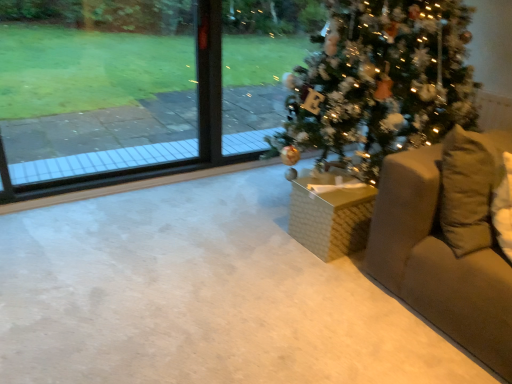
Question: From a real-world perspective, is beige fabric couch at right, the 2th furniture positioned from the left, beneath transparent glass window at upper left?

Choices:
 (A) no
 (B) yes

Answer: (B)

Question: Is transparent glass window at upper left at the back of beige fabric couch at right, the first furniture viewed from the right?

Choices:
 (A) yes
 (B) no

Answer: (B)

Question: Is beige fabric couch at right, the 2th furniture positioned from the left, positioned far away from transparent glass window at upper left?

Choices:
 (A) no
 (B) yes

Answer: (B)

Question: From a real-world perspective, is beige fabric couch at right, the 2th furniture positioned from the left, positioned over transparent glass window at upper left based on gravity?

Choices:
 (A) no
 (B) yes

Answer: (A)

Question: Is beige fabric couch at right, the 2th furniture positioned from the left, positioned behind transparent glass window at upper left?

Choices:
 (A) yes
 (B) no

Answer: (B)

Question: From the image's perspective, is transparent glass window at upper left positioned above or below shiny green christmas tree at center?

Choices:
 (A) above
 (B) below

Answer: (A)

Question: Is transparent glass window at upper left inside or outside of shiny green christmas tree at center?

Choices:
 (A) inside
 (B) outside

Answer: (B)

Question: Is transparent glass window at upper left wider or thinner than shiny green christmas tree at center?

Choices:
 (A) thin
 (B) wide

Answer: (A)

Question: Considering the relative positions of transparent glass window at upper left and shiny green christmas tree at center in the image provided, is transparent glass window at upper left to the left or to the right of shiny green christmas tree at center?

Choices:
 (A) left
 (B) right

Answer: (A)

Question: Is point (53, 124) positioned closer to the camera than point (472, 349)?

Choices:
 (A) farther
 (B) closer

Answer: (A)

Question: Considering the positions of transparent glass window at upper left and beige fabric couch at right, the 2th furniture positioned from the left, in the image, is transparent glass window at upper left wider or thinner than beige fabric couch at right, the 2th furniture positioned from the left,?

Choices:
 (A) thin
 (B) wide

Answer: (A)

Question: In terms of height, does transparent glass window at upper left look taller or shorter compared to beige fabric couch at right, the 2th furniture positioned from the left?

Choices:
 (A) tall
 (B) short

Answer: (A)

Question: From a real-world perspective, is transparent glass window at upper left above or below beige fabric couch at right, the 2th furniture positioned from the left?

Choices:
 (A) below
 (B) above

Answer: (B)

Question: Is shiny green christmas tree at center situated inside beige fabric couch at right, the 2th furniture positioned from the left, or outside?

Choices:
 (A) inside
 (B) outside

Answer: (B)

Question: Is point (334, 92) positioned closer to the camera than point (416, 155)?

Choices:
 (A) closer
 (B) farther

Answer: (B)